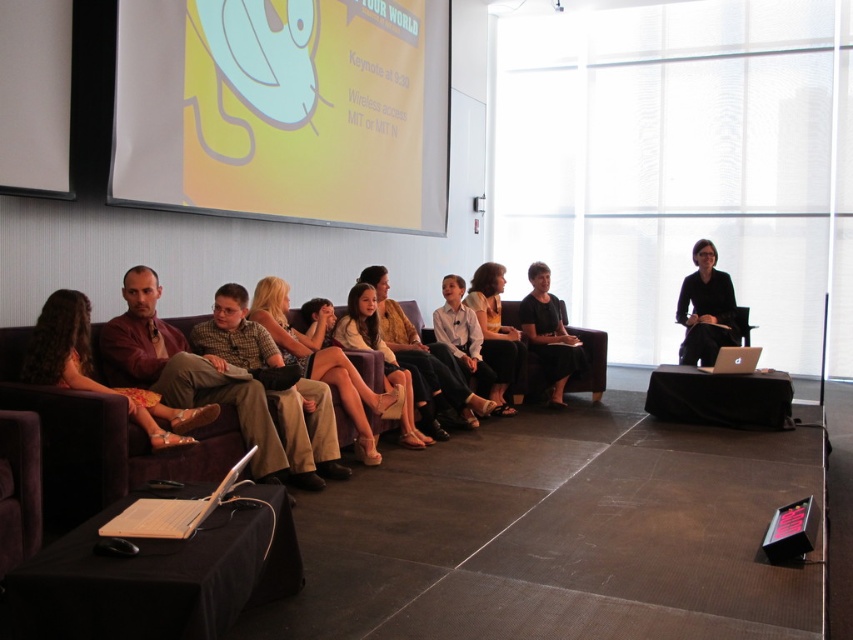
Looking at this image, you are an attendee at this presentation. You want to move from your current position to the silver metallic laptop at right to retrieve your notes. However, there is a matte brown leather couch at left in your path. Can you walk around the couch to reach the laptop?

The matte brown leather couch at left is to the left of the silver metallic laptop at right, so you can walk around the couch to reach the laptop.

You are standing at the center of the conference room and need to move to the black fabric chair at right. Which direction should you walk to reach it?

Since the black fabric chair at right is located at point 0.483 on the x axis and 0.829 on the y axis, you should walk towards the right side of the room to reach it.